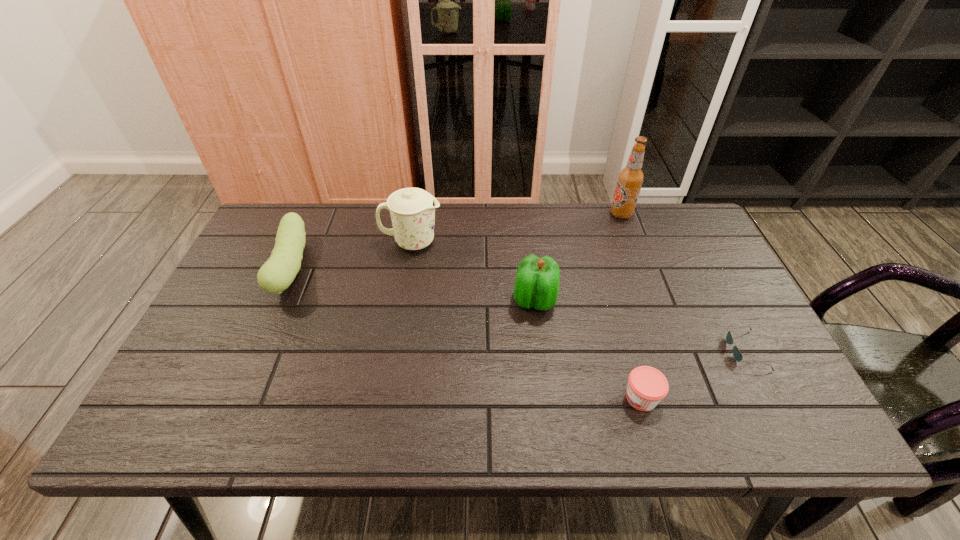
Image resolution: width=960 pixels, height=540 pixels. Identify the location of vacant space situated 0.180m on the front label of the nearest object. (541, 398).

Locate an element on the screen. Image resolution: width=960 pixels, height=540 pixels. blank space located 0.290m on the lenses of the rightmost object is located at coordinates (609, 350).

Locate an element on the screen. vacant space situated 0.300m on the lenses of the rightmost object is located at coordinates (605, 350).

The image size is (960, 540). What are the coordinates of `free spot located 0.220m on the lenses of the rightmost object` in the screenshot? It's located at (638, 350).

In order to click on beer bottle that is at the far edge in this screenshot , I will do `click(630, 179)`.

The width and height of the screenshot is (960, 540). I want to click on chinaware present at the far edge, so click(412, 210).

Identify the location of cucumber that is at the far edge. (279, 271).

Where is `object that is at the near edge`? The image size is (960, 540). object that is at the near edge is located at coordinates (647, 386).

Where is `object that is at the left edge`? The image size is (960, 540). object that is at the left edge is located at coordinates (279, 271).

The image size is (960, 540). Find the location of `object at the right edge`. object at the right edge is located at coordinates (737, 355).